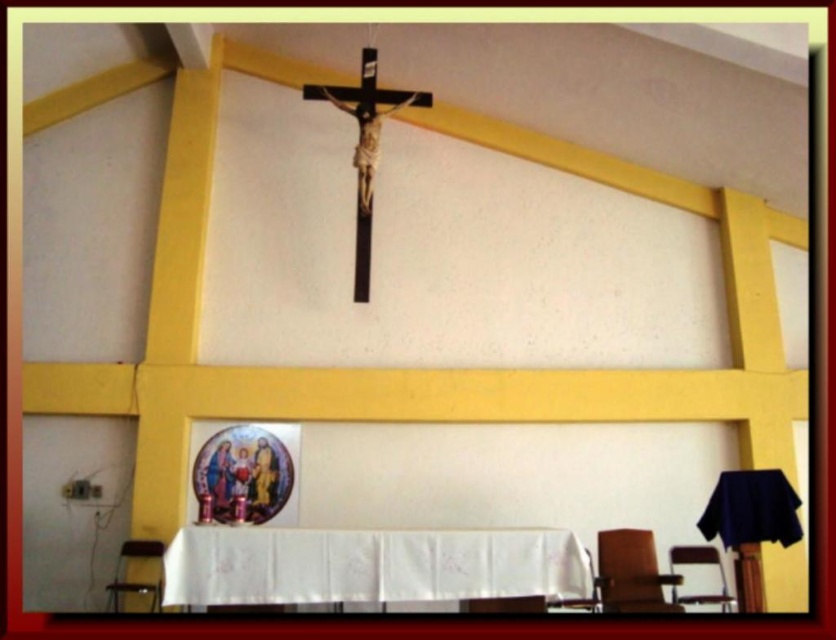
Looking at this image, which is below, brown leather chair at lower right or metallic silver chair at lower right?

metallic silver chair at lower right is below.

Does brown leather chair at lower right appear under metallic silver chair at lower right?

No, brown leather chair at lower right is not below metallic silver chair at lower right.

Which is behind, point (636, 561) or point (676, 547)?

Positioned behind is point (676, 547).

Where is `brown leather chair at lower right`? Image resolution: width=836 pixels, height=640 pixels. brown leather chair at lower right is located at coordinates (631, 572).

In the scene shown: Can you confirm if metallic silver chair at lower right is taller than brown wooden chair at lower center?

Yes, metallic silver chair at lower right is taller than brown wooden chair at lower center.

Which of these two, metallic silver chair at lower right or brown wooden chair at lower center, stands taller?

metallic silver chair at lower right

Which is behind, point (702, 552) or point (492, 608)?

The point (702, 552) is more distant.

Image resolution: width=836 pixels, height=640 pixels. Find the location of `metallic silver chair at lower right`. metallic silver chair at lower right is located at coordinates (701, 563).

In the scene shown: Who is higher up, white cloth-covered table at lower center or brown wooden chair at lower center?

Positioned higher is white cloth-covered table at lower center.

Where is `white cloth-covered table at lower center`? white cloth-covered table at lower center is located at coordinates (370, 564).

At what (x,y) coordinates should I click in order to perform the action: click on white cloth-covered table at lower center. Please return your answer as a coordinate pair (x, y). Looking at the image, I should click on (370, 564).